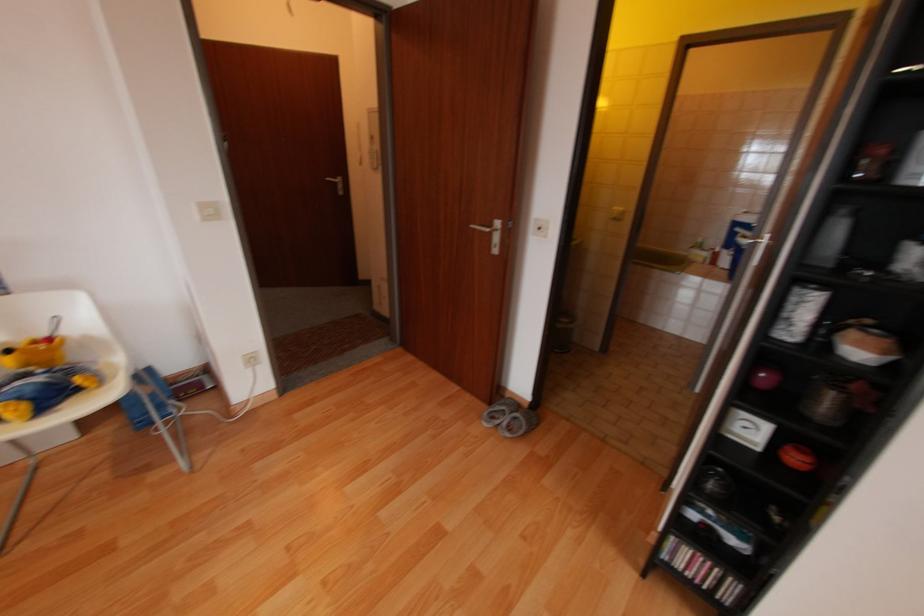
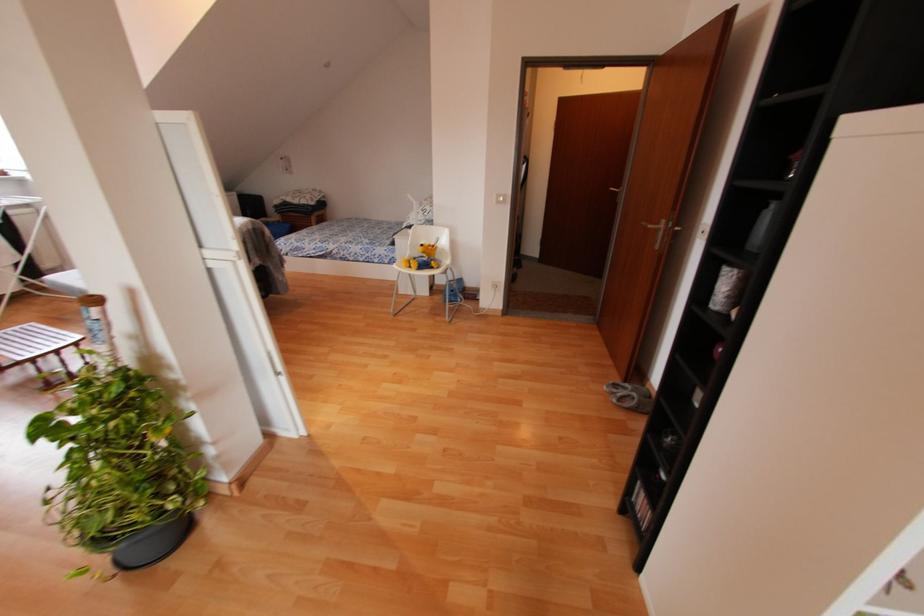
The point at (45, 334) is marked in the first image. Where is the corresponding point in the second image?

(432, 244)